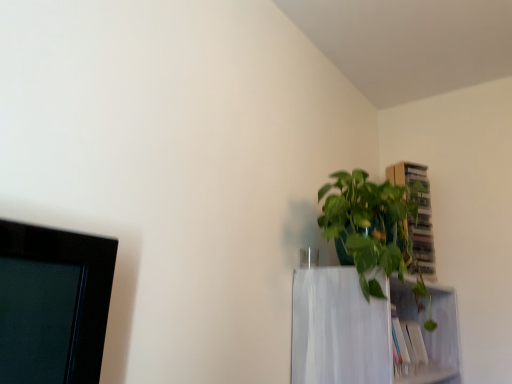
The height and width of the screenshot is (384, 512). What do you see at coordinates (366, 330) in the screenshot?
I see `white matte shelf at upper right` at bounding box center [366, 330].

At what (x,y) coordinates should I click in order to perform the action: click on white matte shelf at upper right. Please return your answer as a coordinate pair (x, y). The height and width of the screenshot is (384, 512). Looking at the image, I should click on (366, 330).

Where is `green glossy plant at upper right`? green glossy plant at upper right is located at coordinates (370, 224).

Does point (291, 359) lie behind point (330, 188)?

No, it is in front of (330, 188).

Which object is more forward, white matte shelf at upper right or green glossy plant at upper right?

Positioned in front is green glossy plant at upper right.

Is white matte shelf at upper right far from green glossy plant at upper right?

white matte shelf at upper right is near green glossy plant at upper right, not far away.

How different are the orientations of green glossy plant at upper right and wooden cabinet at upper right in degrees?

There is a 28.1-degree angle between the facing directions of green glossy plant at upper right and wooden cabinet at upper right.

Consider the image. Who is smaller, green glossy plant at upper right or wooden cabinet at upper right?

Smaller between the two is wooden cabinet at upper right.

Can you confirm if green glossy plant at upper right is positioned to the right of wooden cabinet at upper right?

No.

Is green glossy plant at upper right beside wooden cabinet at upper right?

They are not placed beside each other.

What's the angular difference between wooden cabinet at upper right and green glossy plant at upper right's facing directions?

28.1 degrees separate the facing orientations of wooden cabinet at upper right and green glossy plant at upper right.

Consider the image. Is wooden cabinet at upper right further to camera compared to green glossy plant at upper right?

Yes, the depth of wooden cabinet at upper right is greater than that of green glossy plant at upper right.

Where is `houseplant below the wooden cabinet at upper right (from a real-world perspective)`? The height and width of the screenshot is (384, 512). houseplant below the wooden cabinet at upper right (from a real-world perspective) is located at coordinates (370, 224).

From a real-world perspective, relative to green glossy plant at upper right, is wooden cabinet at upper right vertically above or below?

wooden cabinet at upper right is above green glossy plant at upper right.

In the image, is green glossy plant at upper right positioned in front of or behind white matte shelf at upper right?

green glossy plant at upper right is positioned closer to the viewer than white matte shelf at upper right.

Looking at the image, does green glossy plant at upper right seem bigger or smaller compared to white matte shelf at upper right?

In the image, green glossy plant at upper right appears to be larger than white matte shelf at upper right.

Between green glossy plant at upper right and white matte shelf at upper right, which one appears on the right side from the viewer's perspective?

Positioned to the right is white matte shelf at upper right.

Considering the relative positions of white matte shelf at upper right and wooden cabinet at upper right in the image provided, is white matte shelf at upper right to the right of wooden cabinet at upper right from the viewer's perspective?

No, white matte shelf at upper right is not to the right of wooden cabinet at upper right.

Is wooden cabinet at upper right a part of white matte shelf at upper right?

No, wooden cabinet at upper right is not surrounded by white matte shelf at upper right.

Is white matte shelf at upper right wider or thinner than wooden cabinet at upper right?

white matte shelf at upper right is wider than wooden cabinet at upper right.

Is white matte shelf at upper right further to the viewer compared to wooden cabinet at upper right?

No, the depth of white matte shelf at upper right is less than that of wooden cabinet at upper right.

From the image's perspective, is wooden cabinet at upper right under white matte shelf at upper right?

Incorrect, from the image's perspective, wooden cabinet at upper right is higher than white matte shelf at upper right.

Is white matte shelf at upper right surrounded by wooden cabinet at upper right?

No, white matte shelf at upper right is not surrounded by wooden cabinet at upper right.

Based on their sizes in the image, would you say wooden cabinet at upper right is bigger or smaller than white matte shelf at upper right?

In the image, wooden cabinet at upper right appears to be smaller than white matte shelf at upper right.

You are a GUI agent. You are given a task and a screenshot of the screen. Output one action in this format:
    pyautogui.click(x=<x>, y=<y>)
    Task: Click on the houseplant that is in front of the white matte shelf at upper right
    The height and width of the screenshot is (384, 512).
    Given the screenshot: What is the action you would take?
    pyautogui.click(x=370, y=224)

Locate an element on the screen. The width and height of the screenshot is (512, 384). cabinet located above the green glossy plant at upper right (from the image's perspective) is located at coordinates (418, 215).

Based on their spatial positions, is white matte shelf at upper right or wooden cabinet at upper right closer to green glossy plant at upper right?

Among the two, white matte shelf at upper right is located nearer to green glossy plant at upper right.

In the scene shown: Looking at the image, which one is located further to white matte shelf at upper right, green glossy plant at upper right or wooden cabinet at upper right?

wooden cabinet at upper right is further to white matte shelf at upper right.

When comparing their distances from white matte shelf at upper right, does wooden cabinet at upper right or green glossy plant at upper right seem closer?

green glossy plant at upper right is positioned closer to the anchor white matte shelf at upper right.

Looking at the image, which one is located closer to wooden cabinet at upper right, green glossy plant at upper right or white matte shelf at upper right?

green glossy plant at upper right lies closer to wooden cabinet at upper right than the other object.

In the scene shown: From the image, which object appears to be nearer to green glossy plant at upper right, wooden cabinet at upper right or white matte shelf at upper right?

white matte shelf at upper right is positioned closer to the anchor green glossy plant at upper right.

Estimate the real-world distances between objects in this image. Which object is closer to wooden cabinet at upper right, white matte shelf at upper right or green glossy plant at upper right?

green glossy plant at upper right lies closer to wooden cabinet at upper right than the other object.

I want to click on shelf between green glossy plant at upper right and wooden cabinet at upper right from front to back, so click(366, 330).